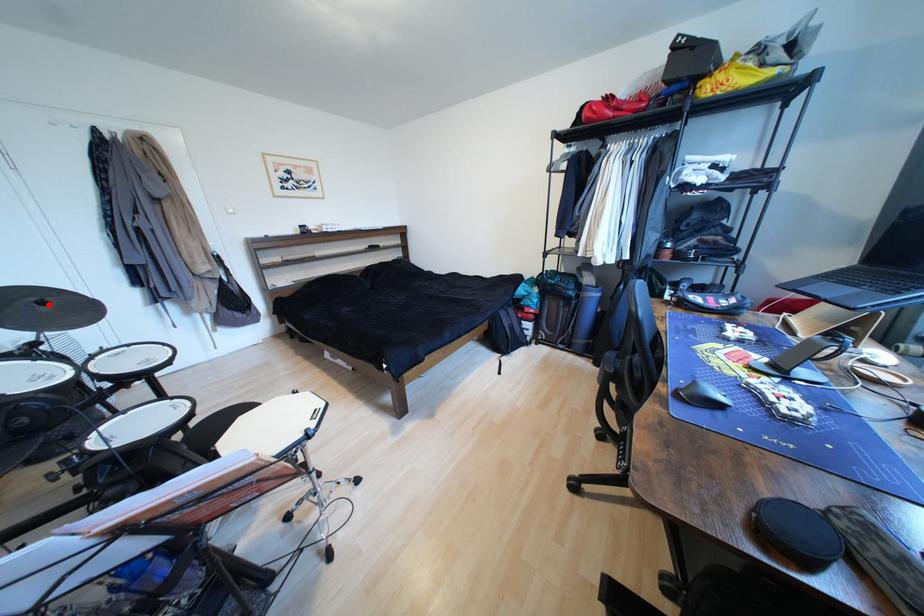
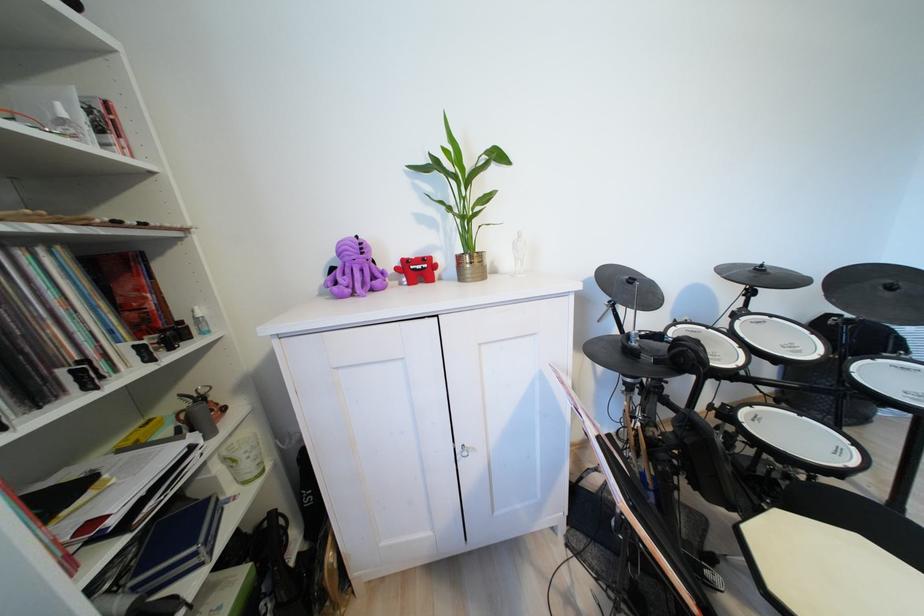
Locate, in the second image, the point that corresponds to the highlighted location in the first image.

(897, 289)